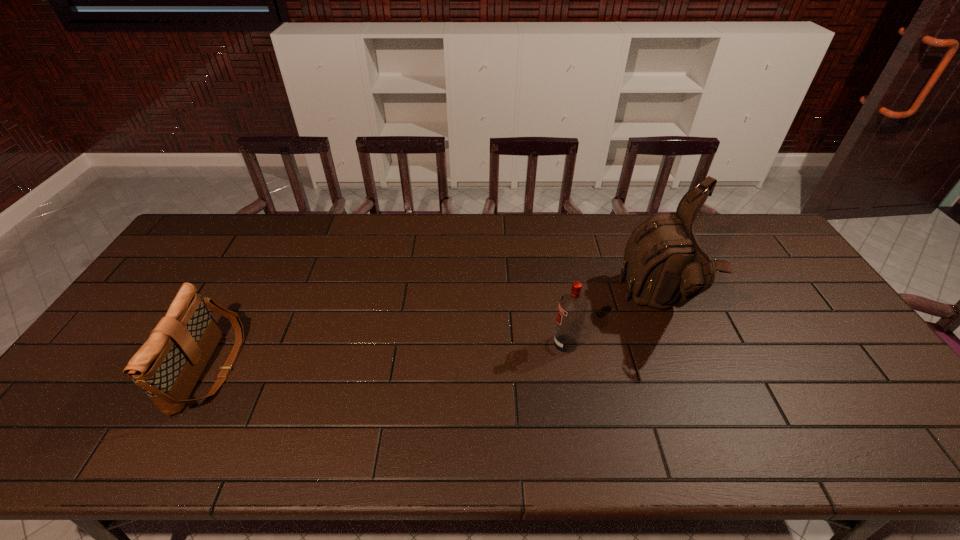
Identify the location of vacant space positioned 0.280m on the front label of the vodka. This screenshot has width=960, height=540. (449, 343).

At what (x,y) coordinates should I click in order to perform the action: click on free space located 0.200m on the front-facing side of the leftmost object. Please return your answer as a coordinate pair (x, y). This screenshot has width=960, height=540. Looking at the image, I should click on (x=311, y=369).

In the image, there is a desktop. Identify the location of vacant area at the far edge. (422, 243).

Where is `vacant space at the near edge`? Image resolution: width=960 pixels, height=540 pixels. vacant space at the near edge is located at coordinates pos(594,430).

In the image, there is a desktop. At what (x,y) coordinates should I click in order to perform the action: click on vacant space at the left edge. Please return your answer as a coordinate pair (x, y). The height and width of the screenshot is (540, 960). Looking at the image, I should click on (145, 338).

This screenshot has height=540, width=960. I want to click on free spot at the right edge of the desktop, so click(x=876, y=387).

In the image, there is a desktop. At what (x,y) coordinates should I click in order to perform the action: click on vacant area at the far left corner. Please return your answer as a coordinate pair (x, y). This screenshot has width=960, height=540. Looking at the image, I should click on (180, 247).

Identify the location of free point at the far right corner. (727, 228).

Identify the location of free point between the leftmost object and the tallest object. (434, 337).

At what (x,y) coordinates should I click in order to perform the action: click on free space between the vodka and the left shoulder bag. Please return your answer as a coordinate pair (x, y). Looking at the image, I should click on (388, 356).